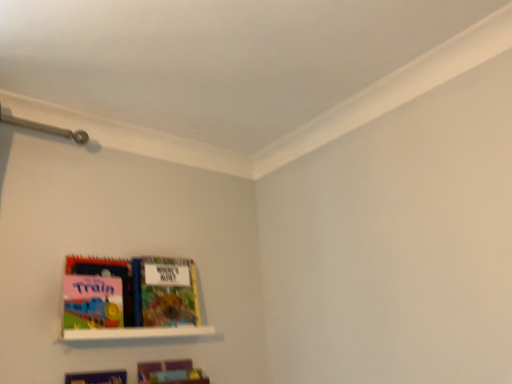
I want to click on blank space situated above white glossy shelf at lower left (from a real-world perspective), so click(x=143, y=318).